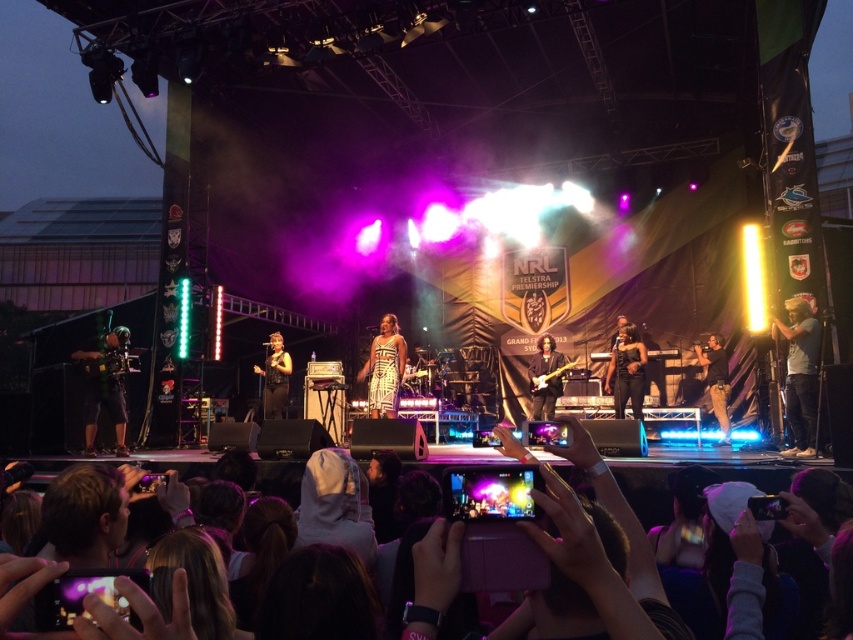
Question: Which of the following is the closest to the observer?

Choices:
 (A) black leather jacket at center
 (B) matte black camera at left

Answer: (B)

Question: Does black leather guitar at center lie in front of matte black microphone at center?

Choices:
 (A) yes
 (B) no

Answer: (A)

Question: Where is matte black camera at left located in relation to white printed dress at center in the image?

Choices:
 (A) below
 (B) above

Answer: (A)

Question: Is black leather guitar at center smaller than matte black microphone at center?

Choices:
 (A) yes
 (B) no

Answer: (A)

Question: Which point is closer to the camera taking this photo?

Choices:
 (A) (627, 371)
 (B) (718, 444)
 (C) (383, 392)
 (D) (280, 365)

Answer: (C)

Question: Which object appears farthest from the camera in this image?

Choices:
 (A) matte black microphone at center
 (B) white cotton shirt at right

Answer: (A)